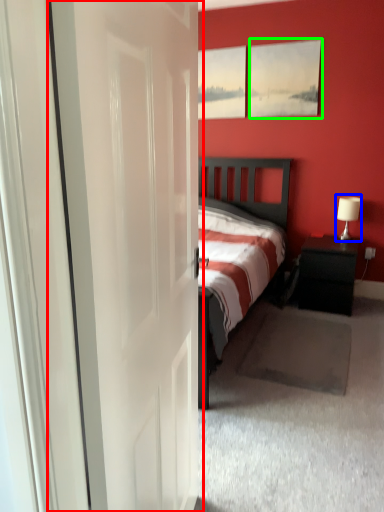
Question: Which object is the closest to the door (highlighted by a red box)? Choose among these: table lamp (highlighted by a blue box) or picture frame (highlighted by a green box).

Choices:
 (A) table lamp
 (B) picture frame

Answer: (A)